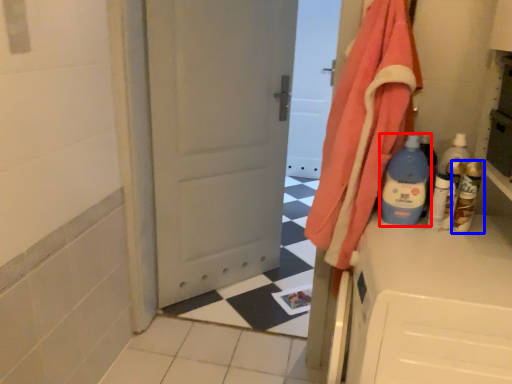
Question: Which point is further to the camera, bottle (highlighted by a red box) or bottle (highlighted by a blue box)?

Choices:
 (A) bottle
 (B) bottle

Answer: (B)